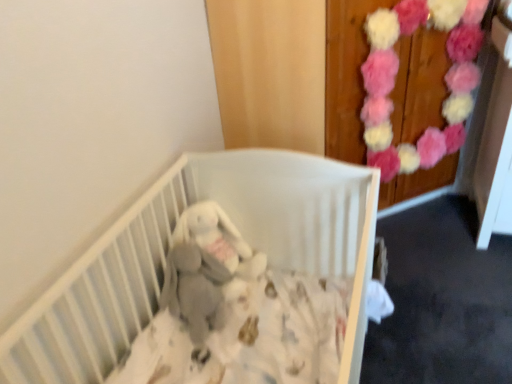
Measure the distance between point (463, 50) and camera.

Point (463, 50) is 2.00 meters away from camera.

You are a GUI agent. You are given a task and a screenshot of the screen. Output one action in this format:
    pyautogui.click(x=<x>, y=<y>)
    Task: Click on the gray plush baby elephant at center
    
    Given the screenshot: What is the action you would take?
    click(x=215, y=245)

Which object is thinner, puffy fabric flowers at upper right or gray plush baby elephant at center?

Thinner between the two is puffy fabric flowers at upper right.

Does puffy fabric flowers at upper right appear on the left side of gray plush baby elephant at center?

No, puffy fabric flowers at upper right is not to the left of gray plush baby elephant at center.

Where is `baby elephant on the left of puffy fabric flowers at upper right`? baby elephant on the left of puffy fabric flowers at upper right is located at coordinates (215, 245).

From the image's perspective, is gray plush baby elephant at center over puffy fabric flowers at upper right?

No.

Is gray plush baby elephant at center in front of or behind puffy fabric flowers at upper right in the image?

Clearly, gray plush baby elephant at center is in front of puffy fabric flowers at upper right.

Between point (215, 261) and point (422, 164), which one is positioned behind?

The point (422, 164) is farther.

Is gray plush baby elephant at center turned away from puffy fabric flowers at upper right?

gray plush baby elephant at center is not turned away from puffy fabric flowers at upper right.

Is gray plush baby elephant at center located within white matte crib at center?

Yes, gray plush baby elephant at center is a part of white matte crib at center.

Is the depth of white matte crib at center less than that of gray plush baby elephant at center?

A: Yes, white matte crib at center is in front of gray plush baby elephant at center.

Is white matte crib at center wider than gray plush baby elephant at center?

Indeed, white matte crib at center has a greater width compared to gray plush baby elephant at center.

Which of these two, white matte crib at center or gray plush baby elephant at center, stands taller?

With more height is white matte crib at center.

Could white matte crib at center be considered to be inside puffy fabric flowers at upper right?

No.

Considering the sizes of objects puffy fabric flowers at upper right and white matte crib at center in the image provided, who is wider, puffy fabric flowers at upper right or white matte crib at center?

white matte crib at center.

Does puffy fabric flowers at upper right have a larger size compared to white matte crib at center?

No, puffy fabric flowers at upper right is not bigger than white matte crib at center.

Where is `infant bed that is on the left side of puffy fabric flowers at upper right`? The height and width of the screenshot is (384, 512). infant bed that is on the left side of puffy fabric flowers at upper right is located at coordinates (167, 251).

Which of these two, white matte crib at center or puffy fabric flowers at upper right, is thinner?

puffy fabric flowers at upper right.

Can you confirm if white matte crib at center is positioned to the left of puffy fabric flowers at upper right?

Yes.

Does white matte crib at center have a smaller size compared to puffy fabric flowers at upper right?

Incorrect, white matte crib at center is not smaller in size than puffy fabric flowers at upper right.

Can you confirm if gray plush baby elephant at center is thinner than white matte crib at center?

Yes.

From the image's perspective, is gray plush baby elephant at center on white matte crib at center?

Yes, from the image's perspective, gray plush baby elephant at center is above white matte crib at center.

Is gray plush baby elephant at center at the left side of white matte crib at center?

Yes, gray plush baby elephant at center is to the left of white matte crib at center.

Would you say gray plush baby elephant at center is outside white matte crib at center?

No, gray plush baby elephant at center is not entirely external to white matte crib at center.

At what (x,y) coordinates should I click in order to perform the action: click on flower above the gray plush baby elephant at center (from the image's perspective). Please return your answer as a coordinate pair (x, y). The width and height of the screenshot is (512, 384). Looking at the image, I should click on (395, 75).

The image size is (512, 384). I want to click on flower behind the gray plush baby elephant at center, so click(x=395, y=75).

From the image, which object appears to be nearer to white matte crib at center, gray plush baby elephant at center or puffy fabric flowers at upper right?

gray plush baby elephant at center.

Estimate the real-world distances between objects in this image. Which object is further from white matte crib at center, puffy fabric flowers at upper right or gray plush baby elephant at center?

Based on the image, puffy fabric flowers at upper right appears to be further to white matte crib at center.

Based on their spatial positions, is white matte crib at center or puffy fabric flowers at upper right further from gray plush baby elephant at center?

puffy fabric flowers at upper right is further to gray plush baby elephant at center.

Estimate the real-world distances between objects in this image. Which object is closer to puffy fabric flowers at upper right, gray plush baby elephant at center or white matte crib at center?

white matte crib at center is closer to puffy fabric flowers at upper right.

When comparing their distances from puffy fabric flowers at upper right, does white matte crib at center or gray plush baby elephant at center seem further?

gray plush baby elephant at center is further to puffy fabric flowers at upper right.

Based on their spatial positions, is puffy fabric flowers at upper right or white matte crib at center further from gray plush baby elephant at center?

puffy fabric flowers at upper right is positioned further to the anchor gray plush baby elephant at center.

Where is `baby elephant between white matte crib at center and puffy fabric flowers at upper right from front to back`? This screenshot has height=384, width=512. baby elephant between white matte crib at center and puffy fabric flowers at upper right from front to back is located at coordinates (215, 245).